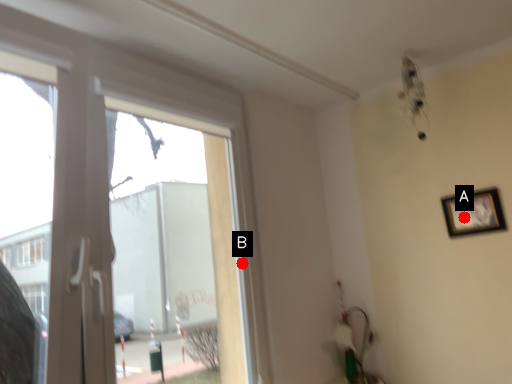
Question: Two points are circled on the image, labeled by A and B beside each circle. Among these points, which one is farthest from the camera?

Choices:
 (A) A is further
 (B) B is further

Answer: (A)